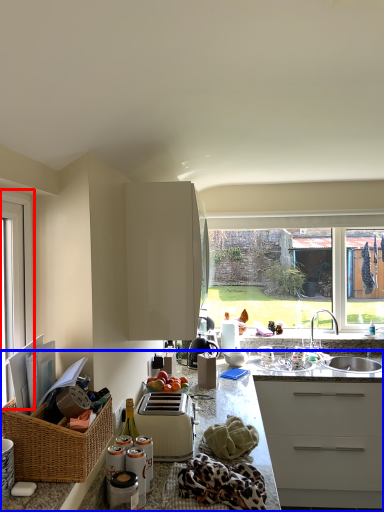
Question: Which object is closer to the camera taking this photo, window (highlighted by a red box) or countertop (highlighted by a blue box)?

Choices:
 (A) window
 (B) countertop

Answer: (B)